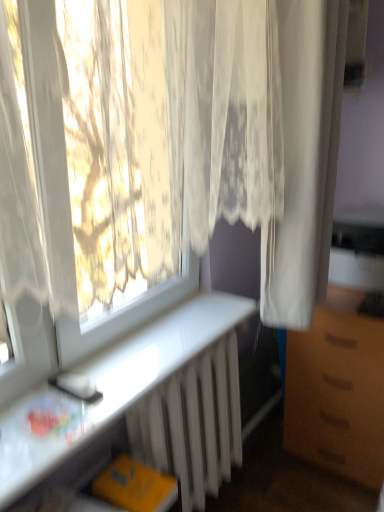
Where is `white lace curtain at upper left, acting as the second curtain starting from the right`? Image resolution: width=384 pixels, height=512 pixels. white lace curtain at upper left, acting as the second curtain starting from the right is located at coordinates (163, 154).

What is the approximate width of white sheer curtain at right, positioned as the second curtain in left-to-right order?

white sheer curtain at right, positioned as the second curtain in left-to-right order, is 6.59 inches wide.

This screenshot has height=512, width=384. I want to click on white metallic radiator at lower center, so click(193, 423).

This screenshot has height=512, width=384. What do you see at coordinates (193, 423) in the screenshot?
I see `white metallic radiator at lower center` at bounding box center [193, 423].

Image resolution: width=384 pixels, height=512 pixels. I want to click on white lace curtain at upper left, which ranks as the 1th curtain in left-to-right order, so click(x=163, y=154).

Is brown matte cabinet at right directly adjacent to white metallic radiator at lower center?

No, brown matte cabinet at right is not making contact with white metallic radiator at lower center.

Is point (314, 328) positioned before point (140, 434)?

No, (314, 328) is further to viewer.

Between brown matte cabinet at right and white metallic radiator at lower center, which one appears on the right side from the viewer's perspective?

Positioned to the right is brown matte cabinet at right.

Who is bigger, brown matte cabinet at right or white metallic radiator at lower center?

With larger size is brown matte cabinet at right.

Measure the distance between brown matte cabinet at right and white glossy desk at lower left.

brown matte cabinet at right and white glossy desk at lower left are 48.23 centimeters apart.

Does point (325, 458) appear closer or farther from the camera than point (204, 378)?

Point (325, 458) is farther from the camera than point (204, 378).

Is brown matte cabinet at right turned away from white glossy desk at lower left?

No, brown matte cabinet at right's orientation is not away from white glossy desk at lower left.

Identify the location of desk on the left of brown matte cabinet at right. (x=144, y=404).

Considering the relative positions of white lace curtain at upper left, acting as the second curtain starting from the right, and brown matte cabinet at right in the image provided, is white lace curtain at upper left, acting as the second curtain starting from the right, in front of brown matte cabinet at right?

Yes, white lace curtain at upper left, acting as the second curtain starting from the right, is closer to the viewer.

Is white lace curtain at upper left, acting as the second curtain starting from the right, looking in the opposite direction of brown matte cabinet at right?

No, white lace curtain at upper left, acting as the second curtain starting from the right, is not facing away from brown matte cabinet at right.

Is point (206, 47) less distant than point (335, 392)?

Yes, point (206, 47) is closer to viewer.

From a real-world perspective, is white lace curtain at upper left, acting as the second curtain starting from the right, on top of brown matte cabinet at right?

Indeed, from a real-world perspective, white lace curtain at upper left, acting as the second curtain starting from the right, stands above brown matte cabinet at right.

Does white metallic radiator at lower center appear on the right side of white lace curtain at upper left, which ranks as the 1th curtain in left-to-right order?

No.

Is white lace curtain at upper left, acting as the second curtain starting from the right, at the back of white metallic radiator at lower center?

No, white metallic radiator at lower center is not facing away from white lace curtain at upper left, acting as the second curtain starting from the right.

Can you confirm if white metallic radiator at lower center is shorter than white lace curtain at upper left, which ranks as the 1th curtain in left-to-right order?

Yes.

I want to click on the 2nd curtain in front of the white metallic radiator at lower center, counting from the anchor's position, so click(x=163, y=154).

Considering the points (337, 7) and (375, 368), which point is in front, point (337, 7) or point (375, 368)?

The point (337, 7) is more forward.

From a real-world perspective, between white sheer curtain at right, positioned as the 1th curtain in right-to-left order, and brown matte cabinet at right, who is vertically higher?

In real-world perspective, white sheer curtain at right, positioned as the 1th curtain in right-to-left order, is above.

Which object is positioned more to the right, white glossy desk at lower left or white lace curtain at upper left, acting as the second curtain starting from the right?

white lace curtain at upper left, acting as the second curtain starting from the right.

Can you confirm if white glossy desk at lower left is bigger than white lace curtain at upper left, which ranks as the 1th curtain in left-to-right order?

Actually, white glossy desk at lower left might be smaller than white lace curtain at upper left, which ranks as the 1th curtain in left-to-right order.

Is white glossy desk at lower left looking in the opposite direction of white lace curtain at upper left, which ranks as the 1th curtain in left-to-right order?

No, white glossy desk at lower left is not facing the opposite direction of white lace curtain at upper left, which ranks as the 1th curtain in left-to-right order.

Is white lace curtain at upper left, acting as the second curtain starting from the right, surrounded by white glossy desk at lower left?

No, white lace curtain at upper left, acting as the second curtain starting from the right, is located outside of white glossy desk at lower left.

Considering the sizes of white glossy desk at lower left and brown matte cabinet at right in the image, is white glossy desk at lower left taller or shorter than brown matte cabinet at right?

Clearly, white glossy desk at lower left is shorter compared to brown matte cabinet at right.

Image resolution: width=384 pixels, height=512 pixels. What are the coordinates of `furniture below the white glossy desk at lower left (from the image's perspective)` in the screenshot? It's located at (337, 390).

Is white glossy desk at lower left turned away from brown matte cabinet at right?

No, white glossy desk at lower left is not facing away from brown matte cabinet at right.

This screenshot has height=512, width=384. Identify the location of radiator in front of the brown matte cabinet at right. (193, 423).

Where is `furniture below the white glossy desk at lower left (from the image's perspective)`? Image resolution: width=384 pixels, height=512 pixels. furniture below the white glossy desk at lower left (from the image's perspective) is located at coordinates (337, 390).

Based on the photo, based on their spatial positions, is white sheer curtain at right, positioned as the 1th curtain in right-to-left order, or brown matte cabinet at right further from white metallic radiator at lower center?

white sheer curtain at right, positioned as the 1th curtain in right-to-left order, is positioned further to the anchor white metallic radiator at lower center.

When comparing their distances from white lace curtain at upper left, acting as the second curtain starting from the right, does brown matte cabinet at right or white glossy desk at lower left seem further?

brown matte cabinet at right is further to white lace curtain at upper left, acting as the second curtain starting from the right.

When comparing their distances from white glossy desk at lower left, does brown matte cabinet at right or white lace curtain at upper left, acting as the second curtain starting from the right, seem closer?

brown matte cabinet at right lies closer to white glossy desk at lower left than the other object.

When comparing their distances from brown matte cabinet at right, does white glossy desk at lower left or white lace curtain at upper left, acting as the second curtain starting from the right, seem further?

white lace curtain at upper left, acting as the second curtain starting from the right, is further to brown matte cabinet at right.

When comparing their distances from white sheer curtain at right, positioned as the second curtain in left-to-right order, does white glossy desk at lower left or white lace curtain at upper left, which ranks as the 1th curtain in left-to-right order, seem further?

The object further to white sheer curtain at right, positioned as the second curtain in left-to-right order, is white glossy desk at lower left.

When comparing their distances from white metallic radiator at lower center, does brown matte cabinet at right or white lace curtain at upper left, acting as the second curtain starting from the right, seem closer?

brown matte cabinet at right.

Which object lies further to the anchor point white glossy desk at lower left, white lace curtain at upper left, which ranks as the 1th curtain in left-to-right order, or white metallic radiator at lower center?

Based on the image, white lace curtain at upper left, which ranks as the 1th curtain in left-to-right order, appears to be further to white glossy desk at lower left.

Based on their spatial positions, is white sheer curtain at right, positioned as the 1th curtain in right-to-left order, or brown matte cabinet at right further from white lace curtain at upper left, acting as the second curtain starting from the right?

Based on the image, brown matte cabinet at right appears to be further to white lace curtain at upper left, acting as the second curtain starting from the right.

This screenshot has height=512, width=384. What are the coordinates of `desk between white lace curtain at upper left, which ranks as the 1th curtain in left-to-right order, and white sheer curtain at right, positioned as the second curtain in left-to-right order, from front to back` in the screenshot? It's located at (144, 404).

This screenshot has width=384, height=512. Identify the location of radiator located between white lace curtain at upper left, acting as the second curtain starting from the right, and brown matte cabinet at right in the depth direction. (193, 423).

At what (x,y) coordinates should I click in order to perform the action: click on desk between white sheer curtain at right, positioned as the 1th curtain in right-to-left order, and white metallic radiator at lower center vertically. Please return your answer as a coordinate pair (x, y). Image resolution: width=384 pixels, height=512 pixels. Looking at the image, I should click on (144, 404).

Find the location of `curtain between white lace curtain at upper left, which ranks as the 1th curtain in left-to-right order, and white metallic radiator at lower center from front to back`. curtain between white lace curtain at upper left, which ranks as the 1th curtain in left-to-right order, and white metallic radiator at lower center from front to back is located at coordinates click(305, 160).